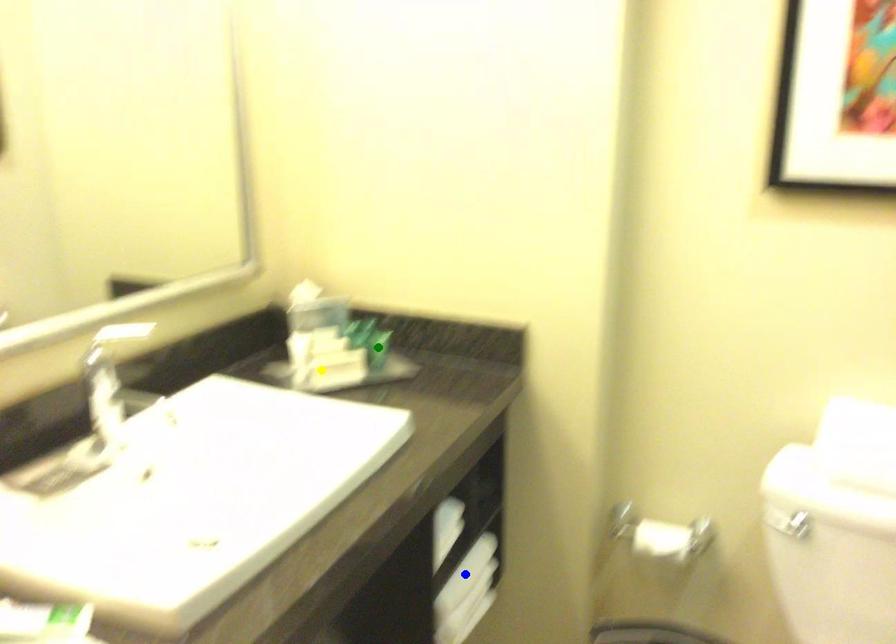
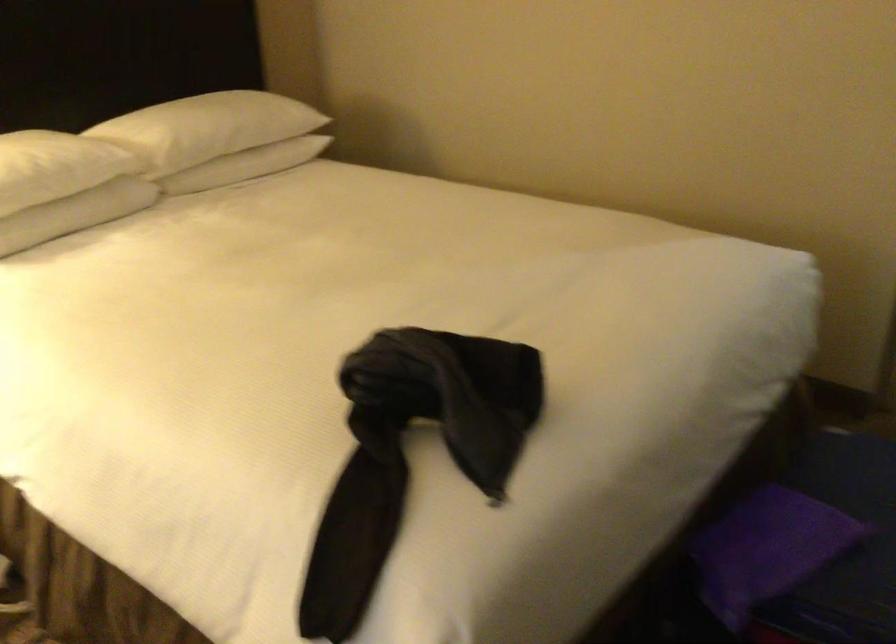
I am providing you with two images of the same scene from different viewpoints. Three points are marked in image1. Which point corresponds to a part or object that is occluded in image2?In image1, three points are marked. Which of them correspond to a part or object that is occluded in image2?Among the three points shown in image1, which one corresponds to a part or object that is no longer visible due to occlusion in image2?

green point, yellow point, blue point cannot be seen in image2.